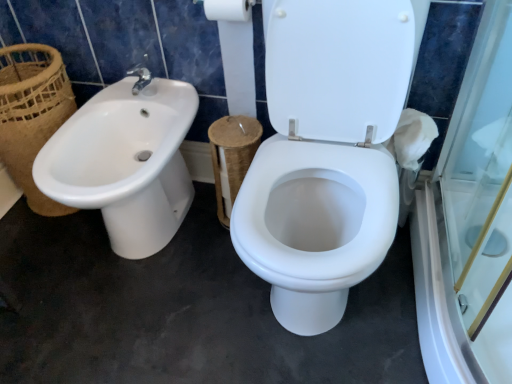
Locate an element on the screen. The height and width of the screenshot is (384, 512). free space in front of brown woven basket at left is located at coordinates (44, 241).